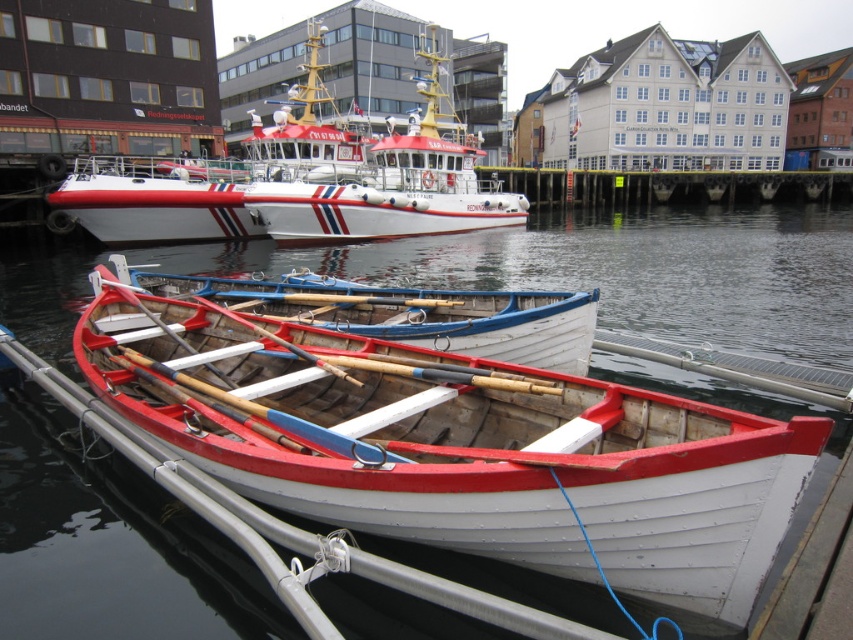
Between white glossy boat at upper center and wooden oars at center, which one is positioned higher?

Positioned higher is white glossy boat at upper center.

Who is lower down, white glossy boat at upper center or wooden oars at center?

wooden oars at center is below.

Does point (97, 195) come farther from viewer compared to point (318, 296)?

Yes, point (97, 195) is farther from viewer.

The width and height of the screenshot is (853, 640). I want to click on white glossy boat at upper center, so click(x=299, y=177).

Is wooden canoe at center positioned behind white glossy boat at upper center?

No, wooden canoe at center is in front of white glossy boat at upper center.

Is point (635, 483) closer to camera compared to point (177, 172)?

That is True.

What are the coordinates of `wooden canoe at center` in the screenshot? It's located at (450, 440).

Is wooden canoe at center closer to camera compared to wooden oars at center?

That is True.

Which of these two, wooden canoe at center or wooden oars at center, stands shorter?

Standing shorter between the two is wooden oars at center.

The width and height of the screenshot is (853, 640). Describe the element at coordinates (450, 440) in the screenshot. I see `wooden canoe at center` at that location.

Where is `wooden canoe at center`? wooden canoe at center is located at coordinates (450, 440).